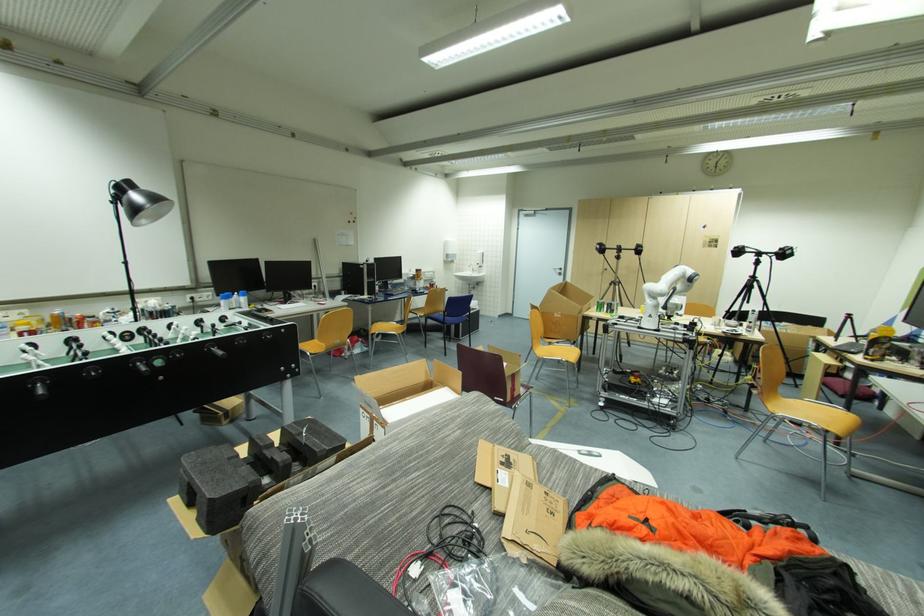
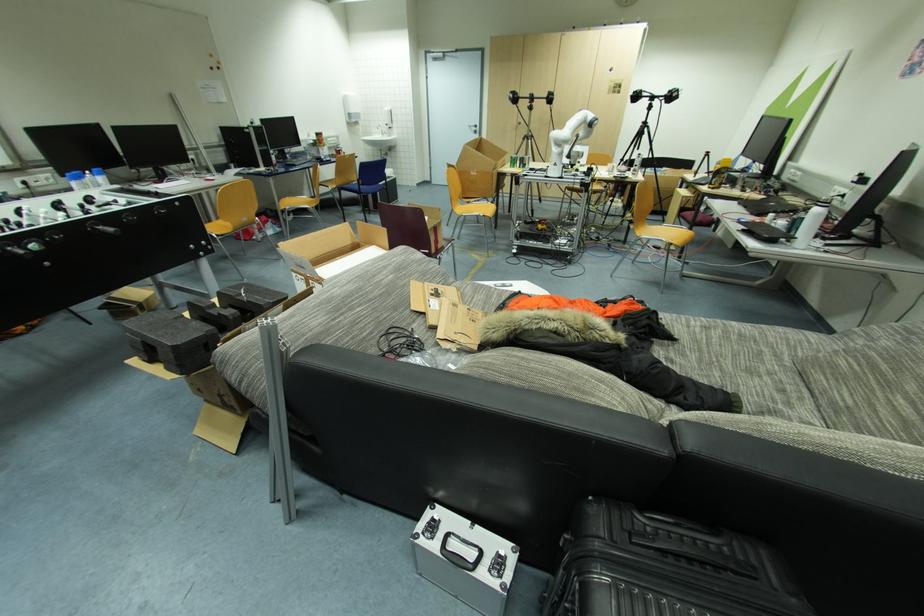
Question: What movement of the cameraman would produce the second image?

Choices:
 (A) Left
 (B) Right
 (C) Forward
 (D) Backward

Answer: (D)